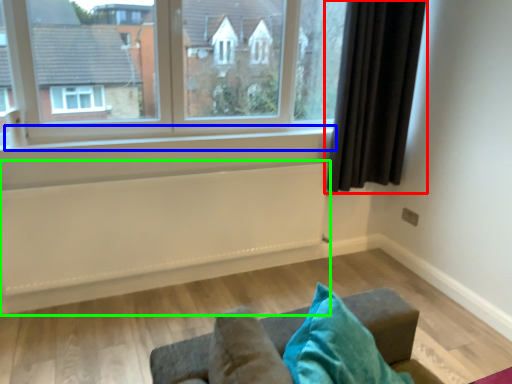
Question: Which object is the farthest from curtain (highlighted by a red box)? Choose among these: window sill (highlighted by a blue box) or radiator (highlighted by a green box).

Choices:
 (A) window sill
 (B) radiator

Answer: (B)